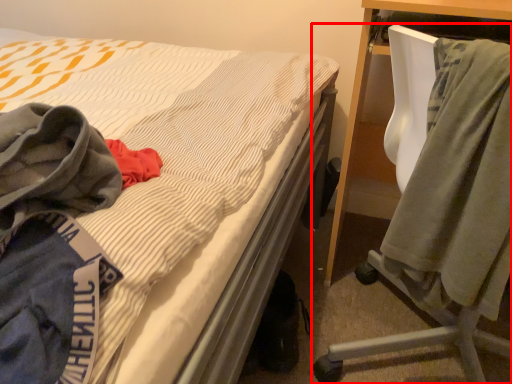
Question: From the image, what is the correct spatial relationship of chair (annotated by the red box) in relation to cloak?

Choices:
 (A) left
 (B) right

Answer: (B)